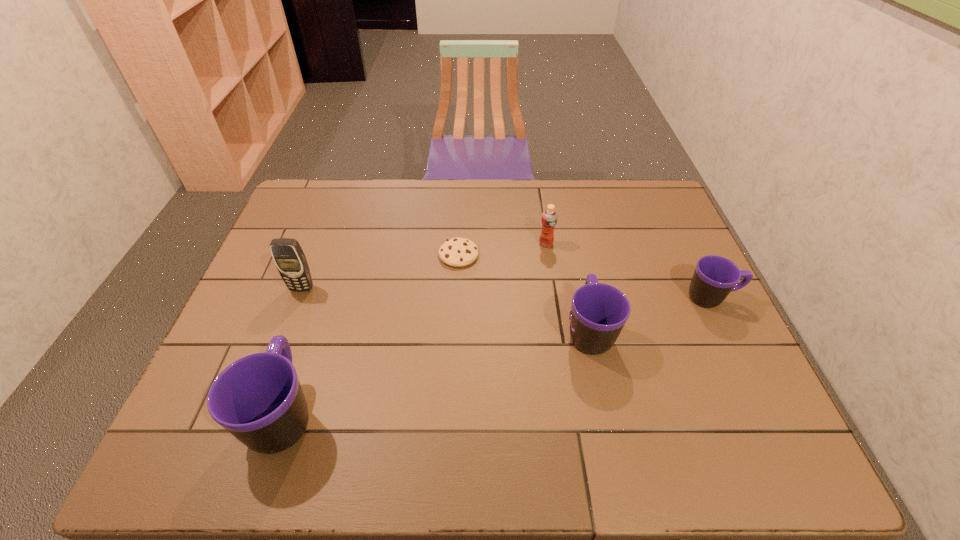
Image resolution: width=960 pixels, height=540 pixels. I want to click on free space located with the handle on the side of the tallest mug, so click(x=334, y=262).

At what (x,y) coordinates should I click in order to perform the action: click on free space located with the handle on the side of the tallest mug. Please return your answer as a coordinate pair (x, y). Looking at the image, I should click on (314, 323).

The height and width of the screenshot is (540, 960). Identify the location of vacant position located with the handle on the side of the second shortest mug. (576, 272).

In order to click on free space located with the handle on the side of the second shortest mug in this screenshot , I will do `click(567, 228)`.

In order to click on blank space located with the handle on the side of the second shortest mug in this screenshot , I will do `click(567, 228)`.

This screenshot has height=540, width=960. Identify the location of free space located on the right of the orange juice. (621, 244).

Find the location of a particular element. free region located 0.100m on the front face of the cellular telephone is located at coordinates (289, 321).

Image resolution: width=960 pixels, height=540 pixels. Identify the location of free region located 0.120m on the left of the fourth object from right to left. (399, 255).

At what (x,y) coordinates should I click in order to perform the action: click on object that is positioned at the near edge. Please return your answer as a coordinate pair (x, y). The height and width of the screenshot is (540, 960). Looking at the image, I should click on (258, 398).

Where is `mug located in the left edge section of the desktop`? mug located in the left edge section of the desktop is located at coordinates (258, 398).